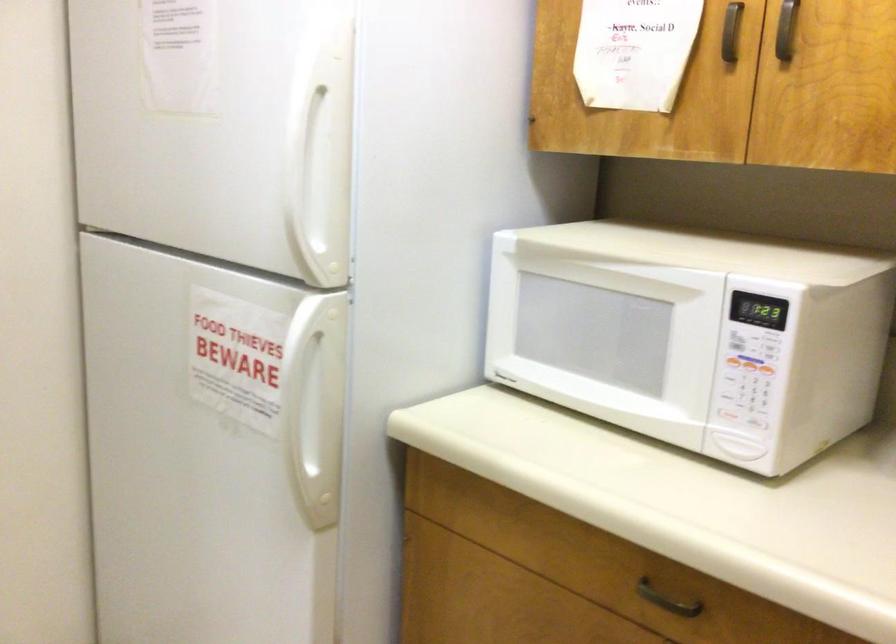
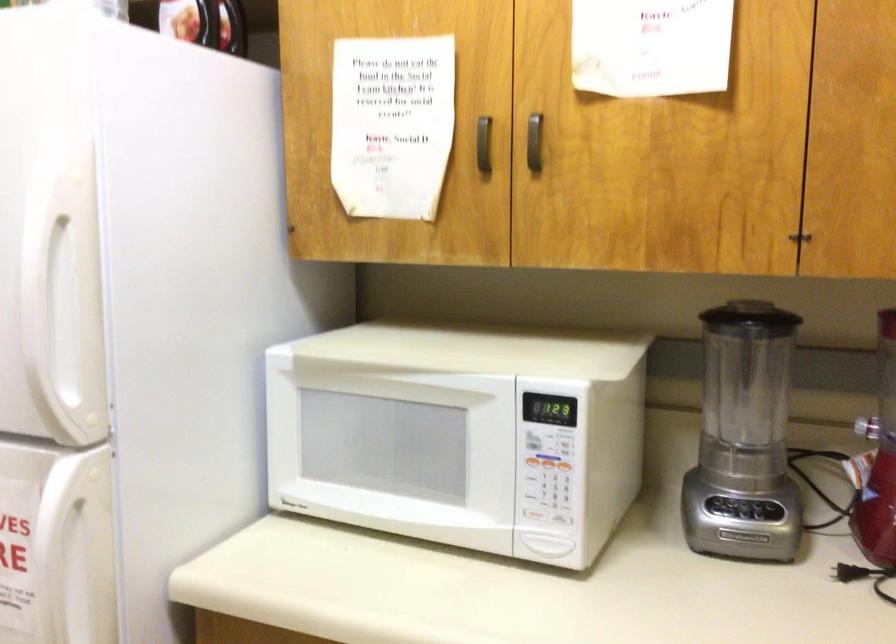
In the second image, find the point that corresponds to [727,411] in the first image.

(533, 515)